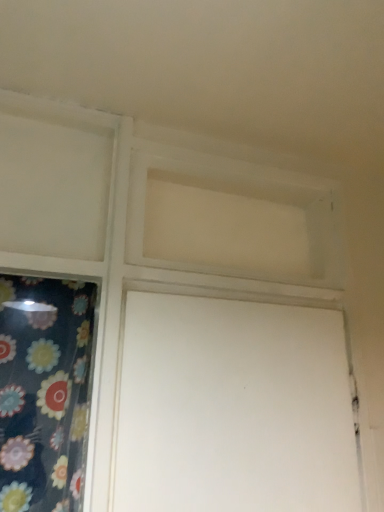
Where is `white matte window at upper center`? The height and width of the screenshot is (512, 384). white matte window at upper center is located at coordinates (230, 222).

What do you see at coordinates (230, 222) in the screenshot? I see `white matte window at upper center` at bounding box center [230, 222].

Locate an element on the screen. white matte window at upper center is located at coordinates (230, 222).